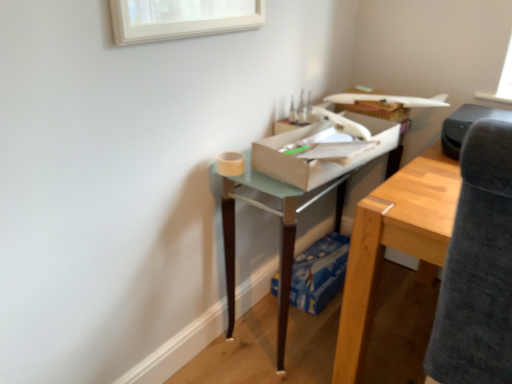
Question: Is white cardboard box at center, which appears as the first cardboard box when viewed from the top, completely or partially outside of blue cardboard box at lower center, which is the second cardboard box in top-to-bottom order?

Choices:
 (A) yes
 (B) no

Answer: (A)

Question: Is white cardboard box at center, which is the 2th cardboard box from back to front, at the left side of blue cardboard box at lower center, the 1th cardboard box positioned from the back?

Choices:
 (A) yes
 (B) no

Answer: (A)

Question: Can you confirm if white cardboard box at center, acting as the 1th cardboard box starting from the front, is taller than blue cardboard box at lower center, the 1th cardboard box positioned from the back?

Choices:
 (A) no
 (B) yes

Answer: (B)

Question: Is white cardboard box at center, acting as the 1th cardboard box starting from the front, bigger than blue cardboard box at lower center, the 1th cardboard box positioned from the back?

Choices:
 (A) no
 (B) yes

Answer: (B)

Question: Can blue cardboard box at lower center, the 1th cardboard box positioned from the back, be found inside white cardboard box at center, acting as the 1th cardboard box starting from the front?

Choices:
 (A) yes
 (B) no

Answer: (B)

Question: Can you confirm if white cardboard box at center, which appears as the first cardboard box when viewed from the top, is smaller than blue cardboard box at lower center, which is the second cardboard box in top-to-bottom order?

Choices:
 (A) yes
 (B) no

Answer: (B)

Question: Would you say blue cardboard box at lower center, which is the second cardboard box in top-to-bottom order, contains translucent glass table at center?

Choices:
 (A) no
 (B) yes

Answer: (A)

Question: From a real-world perspective, is blue cardboard box at lower center, the first cardboard box when ordered from bottom to top, positioned over translucent glass table at center based on gravity?

Choices:
 (A) no
 (B) yes

Answer: (A)

Question: From a real-world perspective, does blue cardboard box at lower center, which is the second cardboard box in top-to-bottom order, sit lower than translucent glass table at center?

Choices:
 (A) no
 (B) yes

Answer: (B)

Question: Does blue cardboard box at lower center, which is the second cardboard box in top-to-bottom order, have a lesser width compared to translucent glass table at center?

Choices:
 (A) no
 (B) yes

Answer: (B)

Question: From the image's perspective, would you say blue cardboard box at lower center, which is the second cardboard box in top-to-bottom order, is shown under translucent glass table at center?

Choices:
 (A) no
 (B) yes

Answer: (B)

Question: Is blue cardboard box at lower center, which is the second cardboard box in top-to-bottom order, bigger than translucent glass table at center?

Choices:
 (A) no
 (B) yes

Answer: (A)

Question: Considering the relative sizes of white cardboard box at center, the 2th cardboard box ordered from the bottom, and translucent glass table at center in the image provided, is white cardboard box at center, the 2th cardboard box ordered from the bottom, shorter than translucent glass table at center?

Choices:
 (A) no
 (B) yes

Answer: (B)